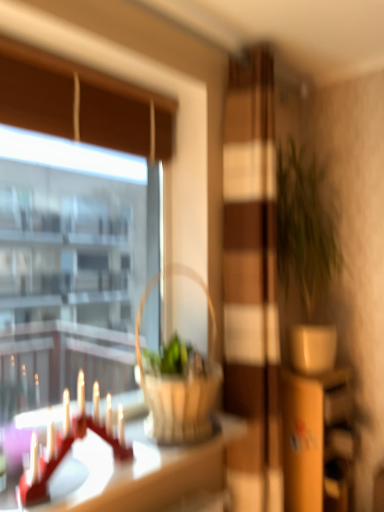
Question: Is the surface of transparent glass window at upper left in direct contact with woven wood picnic basket at center?

Choices:
 (A) yes
 (B) no

Answer: (B)

Question: Can you confirm if transparent glass window at upper left is thinner than woven wood picnic basket at center?

Choices:
 (A) yes
 (B) no

Answer: (A)

Question: From a real-world perspective, does transparent glass window at upper left sit lower than woven wood picnic basket at center?

Choices:
 (A) no
 (B) yes

Answer: (A)

Question: Does transparent glass window at upper left have a greater width compared to woven wood picnic basket at center?

Choices:
 (A) no
 (B) yes

Answer: (A)

Question: Can you confirm if transparent glass window at upper left is shorter than woven wood picnic basket at center?

Choices:
 (A) yes
 (B) no

Answer: (B)

Question: Would you say green matte plant at right is to the left or to the right of wooden dresser at right in the picture?

Choices:
 (A) right
 (B) left

Answer: (B)

Question: From a real-world perspective, is green matte plant at right physically located above or below wooden dresser at right?

Choices:
 (A) below
 (B) above

Answer: (B)

Question: Based on their sizes in the image, would you say green matte plant at right is bigger or smaller than wooden dresser at right?

Choices:
 (A) small
 (B) big

Answer: (A)

Question: Considering the positions of green matte plant at right and wooden dresser at right in the image, is green matte plant at right wider or thinner than wooden dresser at right?

Choices:
 (A) wide
 (B) thin

Answer: (B)

Question: From the image's perspective, is transparent glass window at upper left located above or below wooden dresser at right?

Choices:
 (A) above
 (B) below

Answer: (A)

Question: From a real-world perspective, is transparent glass window at upper left above or below wooden dresser at right?

Choices:
 (A) below
 (B) above

Answer: (B)

Question: Do you think transparent glass window at upper left is within wooden dresser at right, or outside of it?

Choices:
 (A) outside
 (B) inside

Answer: (A)

Question: Does point (28, 118) appear closer or farther from the camera than point (312, 423)?

Choices:
 (A) farther
 (B) closer

Answer: (B)

Question: From the image's perspective, is green matte plant at right located above or below white glossy table at lower left?

Choices:
 (A) below
 (B) above

Answer: (B)

Question: In terms of width, does green matte plant at right look wider or thinner when compared to white glossy table at lower left?

Choices:
 (A) thin
 (B) wide

Answer: (A)